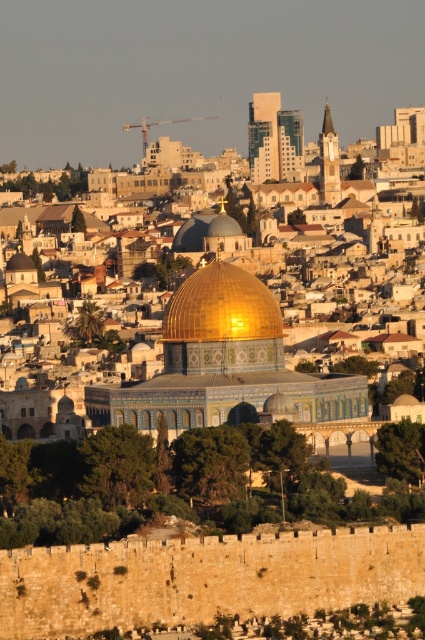
Who is higher up, golden reflective dome at center or goldshinydome at center?

goldshinydome at center

Does golden reflective dome at center have a greater width compared to goldshinydome at center?

Yes.

Find the location of a particular element. golden reflective dome at center is located at coordinates (221, 307).